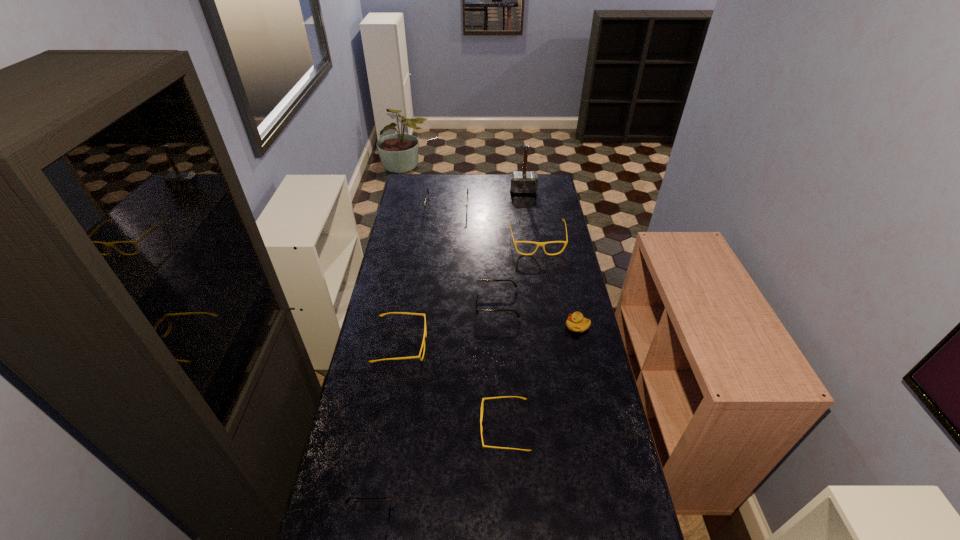
What are the coordinates of `brown hammer` in the screenshot? It's located at (523, 182).

This screenshot has height=540, width=960. In order to click on hammer in this screenshot , I will do [x=523, y=182].

Where is `the farthest beige spectacles`? the farthest beige spectacles is located at coordinates (538, 244).

Find the location of a particular element. The height and width of the screenshot is (540, 960). the fifth nearest spectacles is located at coordinates (538, 244).

You are a GUI agent. You are given a task and a screenshot of the screen. Output one action in this format:
    pyautogui.click(x=<x>, y=<y>)
    Task: Click on the seventh nearest object
    
    Given the screenshot: What is the action you would take?
    pyautogui.click(x=432, y=210)

Where is `the farthest black spectacles`? This screenshot has width=960, height=540. the farthest black spectacles is located at coordinates (432, 210).

The image size is (960, 540). In order to click on yellow duckling in this screenshot , I will do `click(576, 322)`.

Identify the location of the second smallest beige spectacles. (423, 343).

Find the location of a particular element. The height and width of the screenshot is (540, 960). the fourth farthest spectacles is located at coordinates (423, 343).

Find the location of a particular element. The height and width of the screenshot is (540, 960). the second smallest black spectacles is located at coordinates (476, 294).